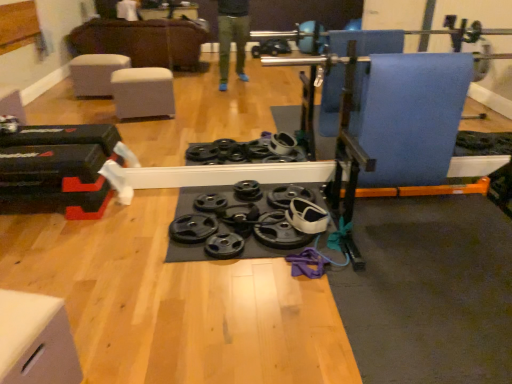
Question: Is point (208, 220) positioned closer to the camera than point (266, 226)?

Choices:
 (A) closer
 (B) farther

Answer: (B)

Question: In terms of width, does black rubber weight plate at center, the first wheel viewed from the left, look wider or thinner when compared to black rubber weight plate at center, positioned as the third wheel in left-to-right order?

Choices:
 (A) wide
 (B) thin

Answer: (B)

Question: Which is farther from the white matte drawer at lower left?

Choices:
 (A) black rubber weight plate at center, positioned as the third wheel in left-to-right order
 (B) black rubber weight plate at center, the first wheel viewed from the left
 (C) black rubber weight plate at center, placed as the 2th wheel when sorted from left to right

Answer: (A)

Question: Which is farther from the white matte drawer at lower left?

Choices:
 (A) black rubber weight plate at center, the first wheel viewed from the left
 (B) black rubber weight plate at center, the 1th wheel from the right
 (C) black rubber weight plate at center, placed as the second wheel when sorted from right to left

Answer: (B)